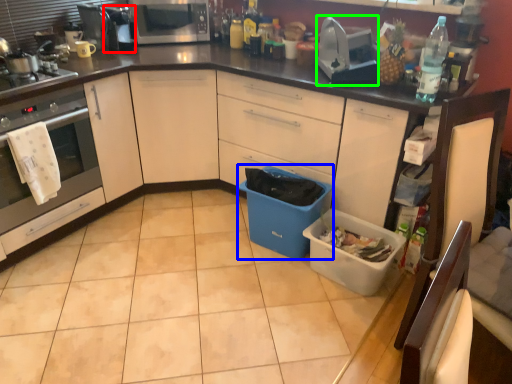
Question: Which object is positioned closest to appliance (highlighted by a red box)? Select from storage box (highlighted by a blue box) and appliance (highlighted by a green box).

Choices:
 (A) storage box
 (B) appliance

Answer: (B)